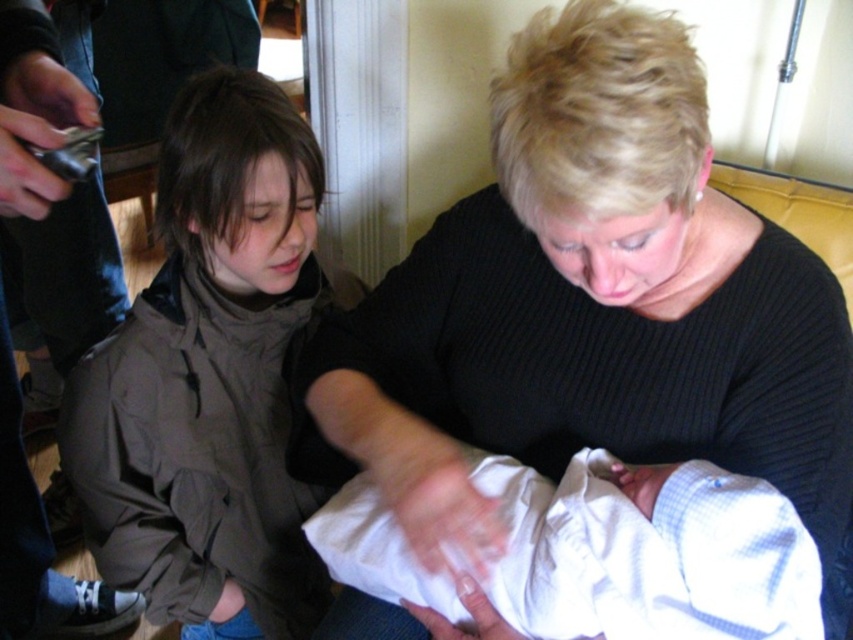
In the scene shown: In the scene where a baby is being held by two people, you notice the black ribbed sweater at center and the white soft cloth at center. Which object is taller?

The black ribbed sweater at center is taller than the white soft cloth at center.

In the scene described, where is the brown matte jacket at left located in terms of coordinates?

The brown matte jacket at left is located at coordinates point (x=210, y=380).